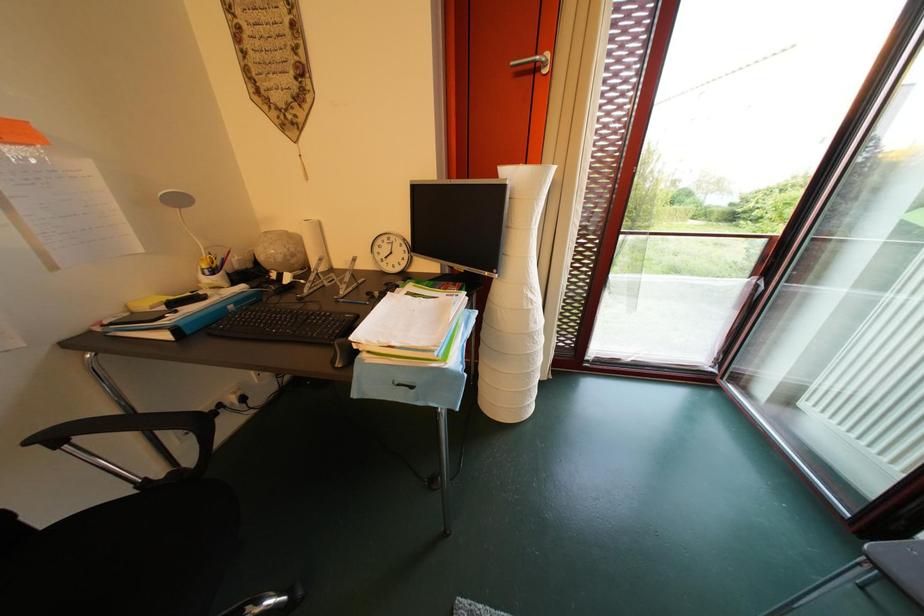
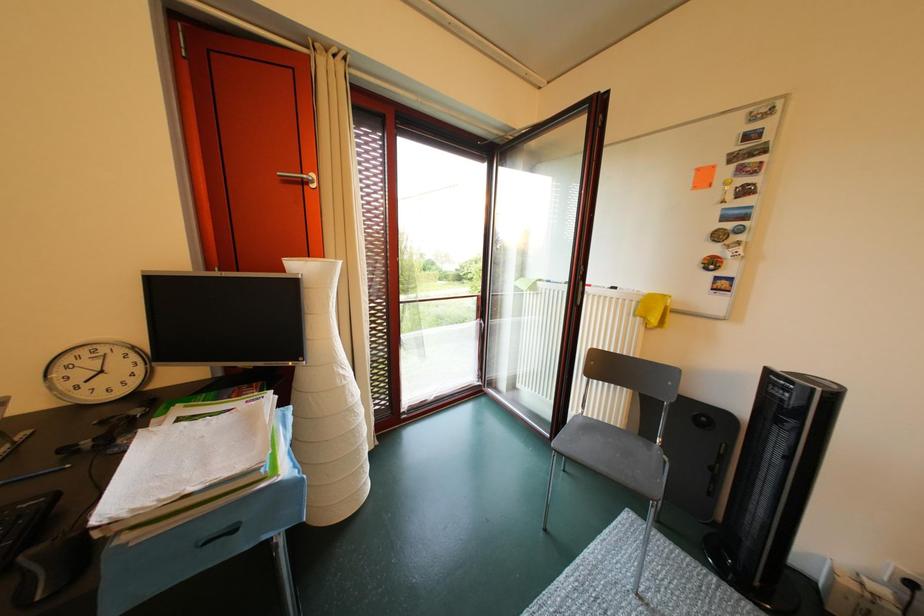
Question: Based on the continuous images, in which direction is the camera rotating? Reply with the corresponding letter.

Choices:
 (A) Left
 (B) Right
 (C) Up
 (D) Down

Answer: (B)